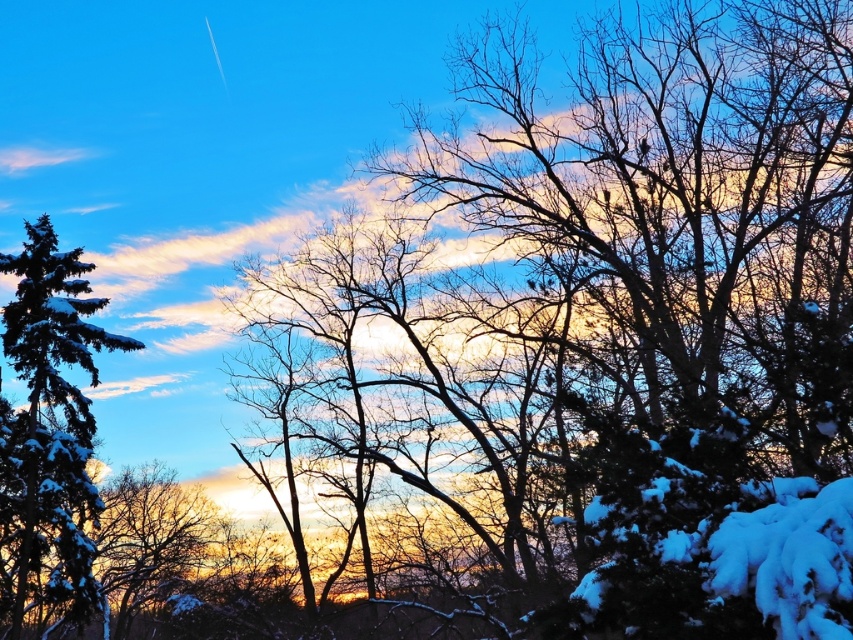
Describe the element at coordinates (49, 429) in the screenshot. The height and width of the screenshot is (640, 853). I see `snow-covered evergreen at left` at that location.

Who is more distant from viewer, (x=77, y=432) or (x=202, y=532)?

Point (x=202, y=532)

This screenshot has height=640, width=853. I want to click on snow-covered evergreen at left, so click(x=49, y=429).